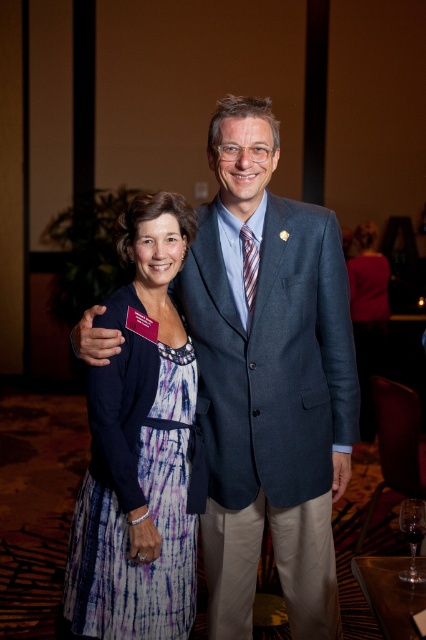
Is purple tie-dye dress at center positioned at the back of silky purple dress at right?

No, purple tie-dye dress at center is closer to the viewer.

Is purple tie-dye dress at center to the left of silky purple dress at right from the viewer's perspective?

Yes, purple tie-dye dress at center is to the left of silky purple dress at right.

Locate an element on the screen. The width and height of the screenshot is (426, 640). purple tie-dye dress at center is located at coordinates (140, 451).

Identify the location of purple tie-dye dress at center. (140, 451).

Is purple tie-dye dress at center bigger than transparent glass at center?

Yes, purple tie-dye dress at center is bigger than transparent glass at center.

Between purple tie-dye dress at center and transparent glass at center, which one is positioned higher?

purple tie-dye dress at center

Which is behind, point (77, 509) or point (416, 516)?

Point (77, 509)

Image resolution: width=426 pixels, height=640 pixels. I want to click on purple tie-dye dress at center, so click(x=140, y=451).

Who is positioned more to the left, blue textured suit at center or transparent glass at center?

blue textured suit at center

Is blue textured suit at center smaller than transparent glass at center?

No, blue textured suit at center is not smaller than transparent glass at center.

The width and height of the screenshot is (426, 640). In order to click on blue textured suit at center in this screenshot , I will do `click(268, 380)`.

The width and height of the screenshot is (426, 640). I want to click on blue textured suit at center, so click(x=268, y=380).